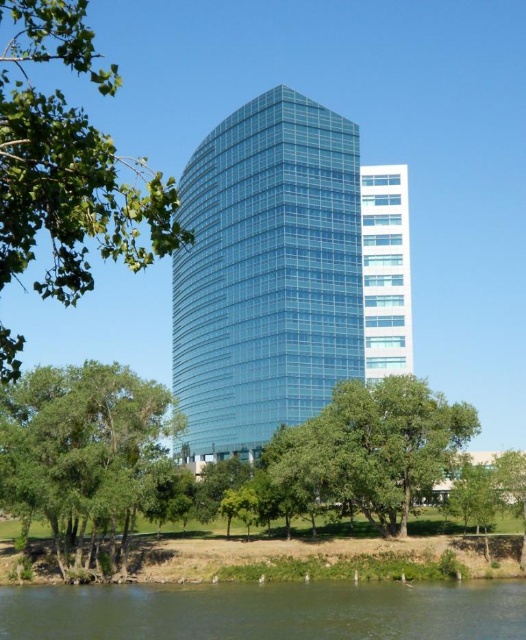
In the scene shown: Which of these two, green water at lower left or green leafy tree at lower left, stands shorter?

Standing shorter between the two is green water at lower left.

Looking at this image, does green water at lower left come in front of green leafy tree at lower left?

Yes, green water at lower left is in front of green leafy tree at lower left.

The width and height of the screenshot is (526, 640). Find the location of `green water at lower left`. green water at lower left is located at coordinates (267, 611).

Describe the element at coordinates (68, 163) in the screenshot. I see `green leafy tree at left` at that location.

Looking at this image, is green leafy tree at left shorter than green leafy tree at center?

In fact, green leafy tree at left may be taller than green leafy tree at center.

At what (x,y) coordinates should I click in order to perform the action: click on green leafy tree at left. Please return your answer as a coordinate pair (x, y). The width and height of the screenshot is (526, 640). Looking at the image, I should click on (68, 163).

In the scene shown: Who is higher up, green leafy tree at left or green leafy tree at lower right?

Positioned higher is green leafy tree at left.

Is point (4, 145) more distant than point (469, 474)?

No, it is not.

Locate an element on the screen. green leafy tree at left is located at coordinates (68, 163).

You are a GUI agent. You are given a task and a screenshot of the screen. Output one action in this format:
    pyautogui.click(x=<x>, y=<y>)
    Task: Click on the green leafy tree at left
    
    Given the screenshot: What is the action you would take?
    pyautogui.click(x=68, y=163)